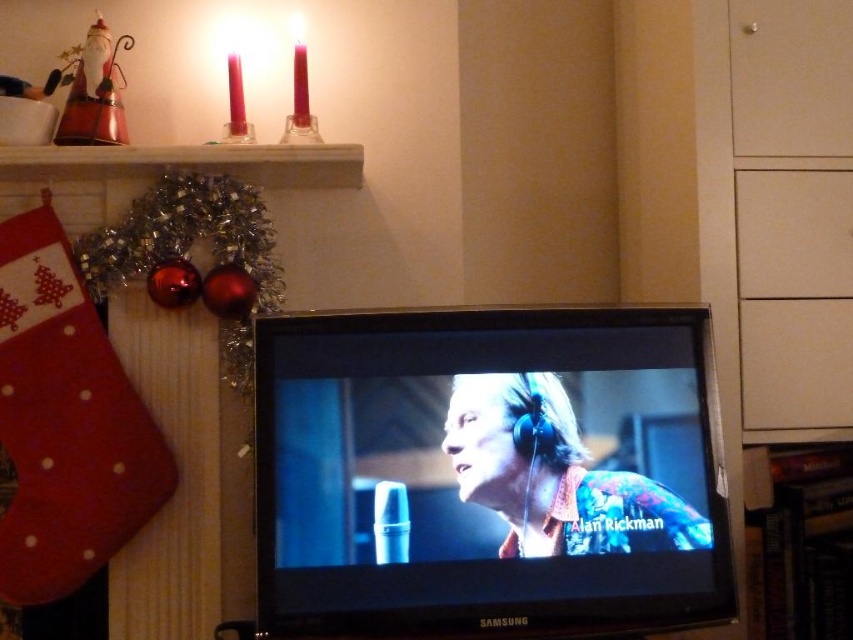
Question: Which object appears farthest from the camera in this image?

Choices:
 (A) white matte drawer at upper right
 (B) matte black tv at center

Answer: (A)

Question: Does matte black tv at center appear on the right side of white matte drawer at upper right?

Choices:
 (A) yes
 (B) no

Answer: (B)

Question: Where is matte black tv at center located in relation to red felt stocking at left in the image?

Choices:
 (A) below
 (B) above

Answer: (A)

Question: Which point appears farthest from the camera in this image?

Choices:
 (A) (693, 481)
 (B) (22, 410)

Answer: (B)

Question: Which of the following is the closest to the observer?

Choices:
 (A) matte black tv at center
 (B) red felt stocking at left

Answer: (A)

Question: Can you confirm if matte black tv at center is positioned below red felt stocking at left?

Choices:
 (A) yes
 (B) no

Answer: (A)